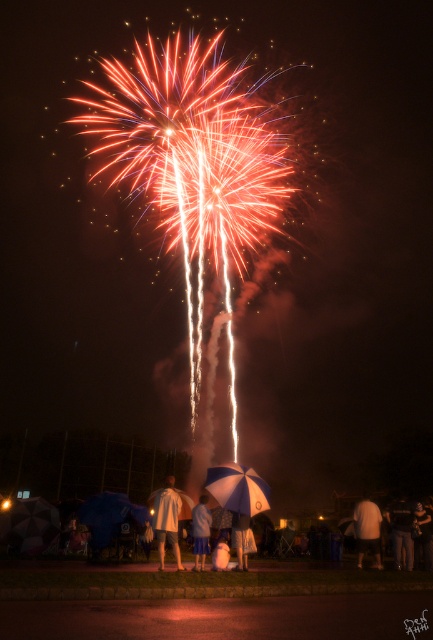
Does dark blue fabric umbrella at center lie in front of white cotton umbrella at center?

No, dark blue fabric umbrella at center is behind white cotton umbrella at center.

Who is higher up, dark blue fabric umbrella at center or white cotton umbrella at center?

white cotton umbrella at center is above.

What do you see at coordinates (423, 536) in the screenshot? I see `dark blue fabric umbrella at center` at bounding box center [423, 536].

The width and height of the screenshot is (433, 640). Identify the location of dark blue fabric umbrella at center. (423, 536).

Does blue matte umbrella at lower center have a greater width compared to white fabric umbrella at center?

No, blue matte umbrella at lower center is not wider than white fabric umbrella at center.

Is blue matte umbrella at lower center bigger than white fabric umbrella at center?

Incorrect, blue matte umbrella at lower center is not larger than white fabric umbrella at center.

Does point (241, 502) come in front of point (232, 545)?

No.

This screenshot has width=433, height=640. In order to click on blue matte umbrella at lower center in this screenshot , I will do `click(238, 488)`.

Based on the photo, is white matte shirt at lower right taller than dark blue fabric umbrella at center?

Correct, white matte shirt at lower right is much taller as dark blue fabric umbrella at center.

Does white matte shirt at lower right appear on the left side of dark blue fabric umbrella at center?

Indeed, white matte shirt at lower right is positioned on the left side of dark blue fabric umbrella at center.

What do you see at coordinates (368, 529) in the screenshot? I see `white matte shirt at lower right` at bounding box center [368, 529].

You are a GUI agent. You are given a task and a screenshot of the screen. Output one action in this format:
    pyautogui.click(x=<x>, y=<y>)
    Task: Click on the white matte shirt at lower right
    Image resolution: width=433 pixels, height=640 pixels.
    Given the screenshot: What is the action you would take?
    pyautogui.click(x=368, y=529)